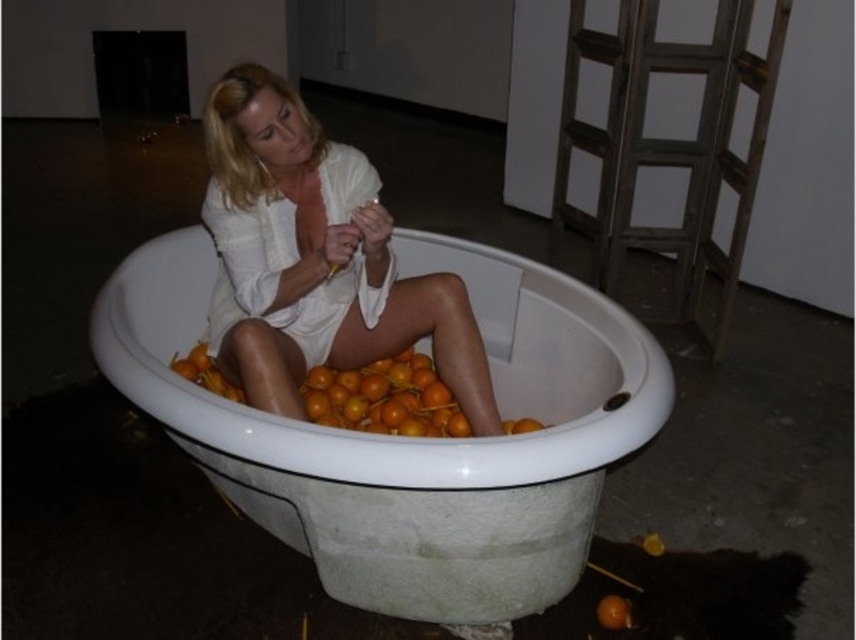
You are a photographer trying to capture the woman in the white matte dress at center. Where should you position your camera to ensure the point at coordinates (314, 259) is visible in the shot?

The point at coordinates (314, 259) is on the white matte dress at center, so positioning the camera to focus on the center area where the woman is located will ensure the point is visible.